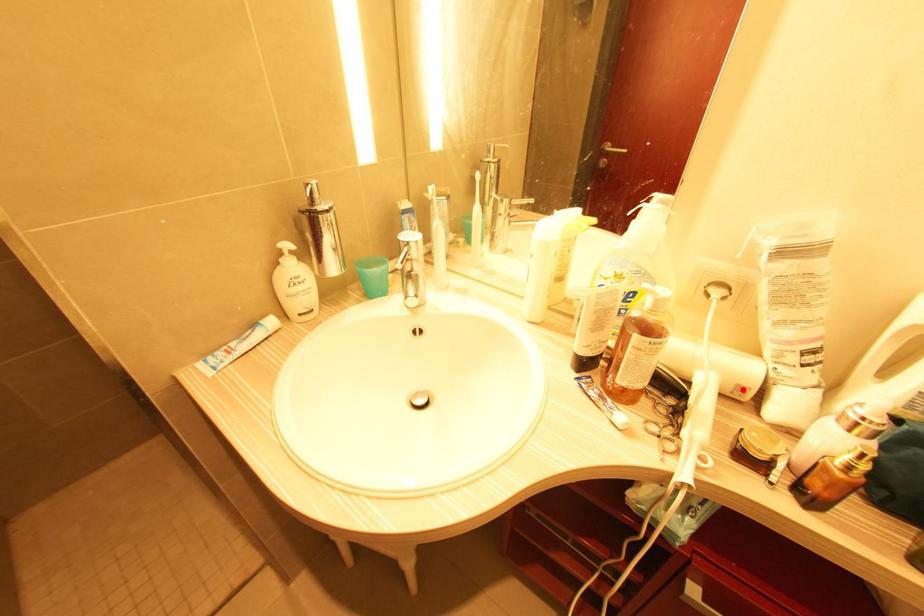
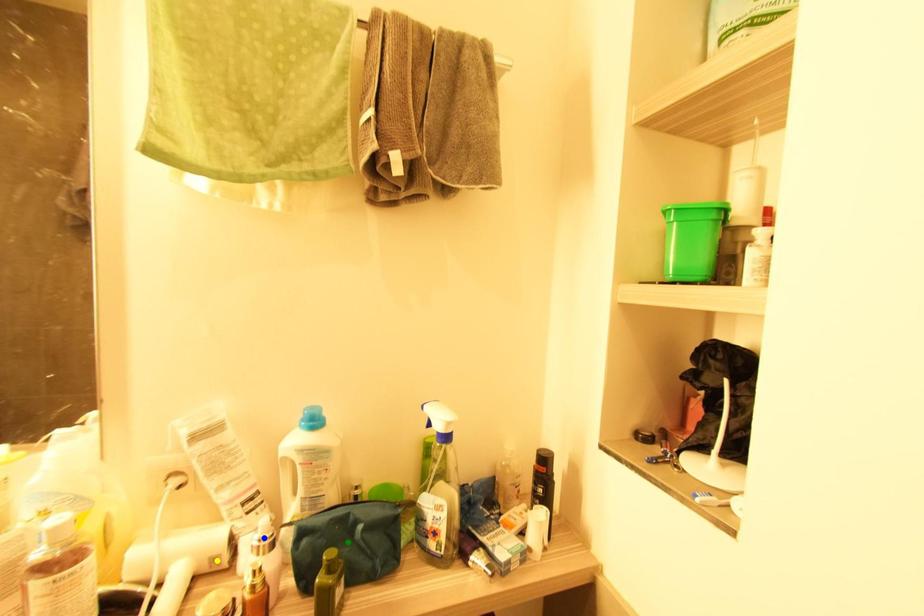
Question: I am providing you with two images of the same scene from different viewpoints. A red point is marked on the first image. You are given multiple points on the second image. Which point in image 2 is actually the same real-world point as the red point in image 1?

Choices:
 (A) green point
 (B) yellow point
 (C) blue point

Answer: (B)